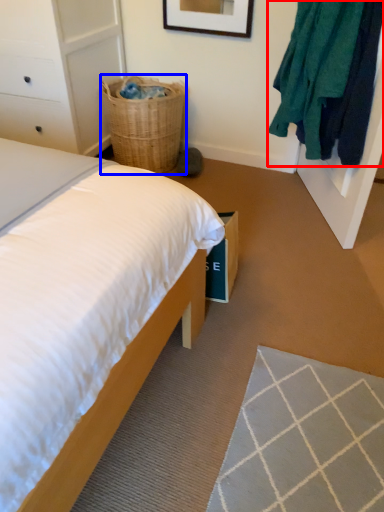
Question: Which of the following is the farthest to the observer, clothing (highlighted by a red box) or basket (highlighted by a blue box)?

Choices:
 (A) clothing
 (B) basket

Answer: (B)